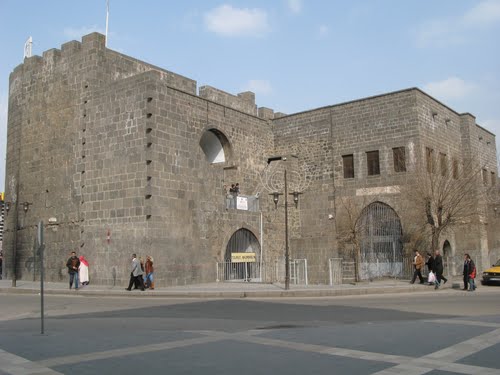
Where is `lantern`? lantern is located at coordinates (286, 271), (16, 215).